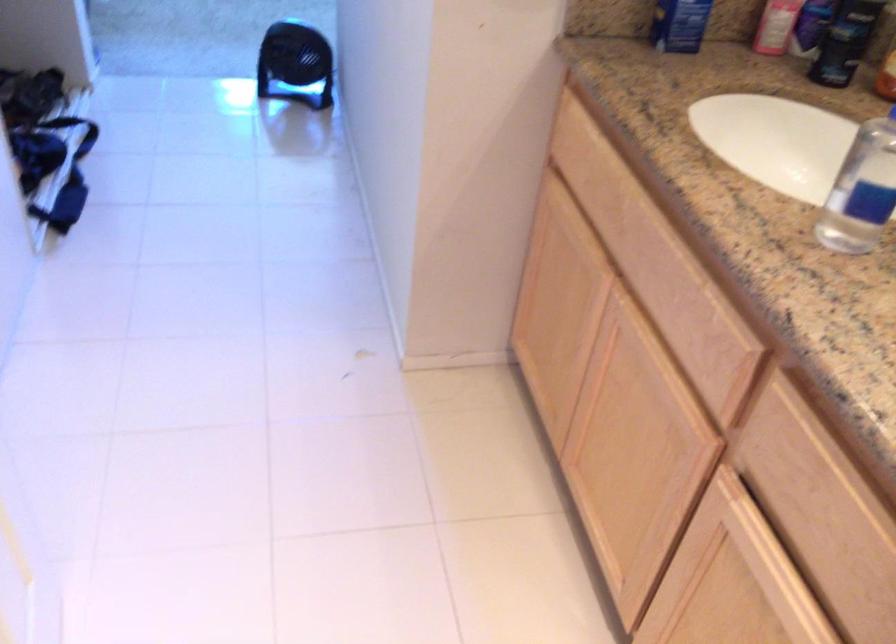
In order to click on wooden drawer pull in this screenshot , I will do `click(754, 536)`.